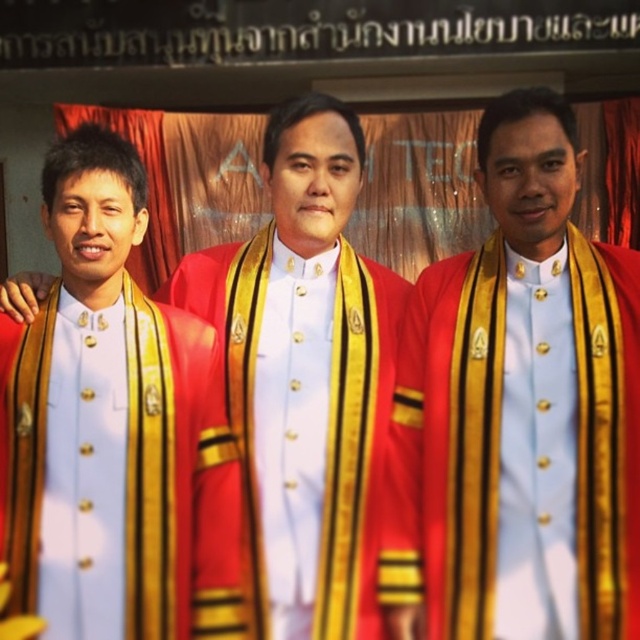
Question: Is the position of matte gold uniform at center less distant than that of red velvet robe at center?

Choices:
 (A) yes
 (B) no

Answer: (A)

Question: Estimate the real-world distances between objects in this image. Which object is closer to the matte gold scarf at center?

Choices:
 (A) red velvet robe at center
 (B) matte gold sash at center
 (C) matte gold uniform at center

Answer: (B)

Question: Is matte gold scarf at center thinner than matte gold uniform at center?

Choices:
 (A) yes
 (B) no

Answer: (B)

Question: Considering the relative positions of matte gold scarf at center and red velvet robe at center in the image provided, where is matte gold scarf at center located with respect to red velvet robe at center?

Choices:
 (A) above
 (B) below

Answer: (A)

Question: Which point is farther to the camera?

Choices:
 (A) matte gold sash at center
 (B) matte gold uniform at center
 (C) red velvet robe at center
 (D) matte gold scarf at center

Answer: (C)

Question: Among these objects, which one is nearest to the camera?

Choices:
 (A) matte gold scarf at center
 (B) red velvet robe at center
 (C) matte gold uniform at center

Answer: (C)